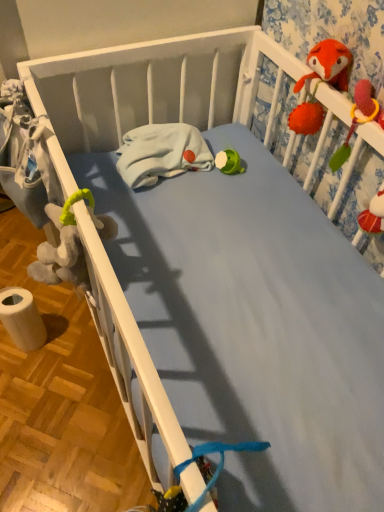
Question: Based on their positions, is white paper towel at lower left located to the left or right of white fleece blanket at center?

Choices:
 (A) left
 (B) right

Answer: (A)

Question: Looking at their shapes, would you say white paper towel at lower left is wider or thinner than white fleece blanket at center?

Choices:
 (A) thin
 (B) wide

Answer: (A)

Question: Which is farther from the soft plush toy at upper right?

Choices:
 (A) white paper towel at lower left
 (B) white fleece blanket at center

Answer: (A)

Question: Considering the real-world distances, which object is farthest from the white paper towel at lower left?

Choices:
 (A) white fleece blanket at center
 (B) soft plush toy at upper right

Answer: (B)